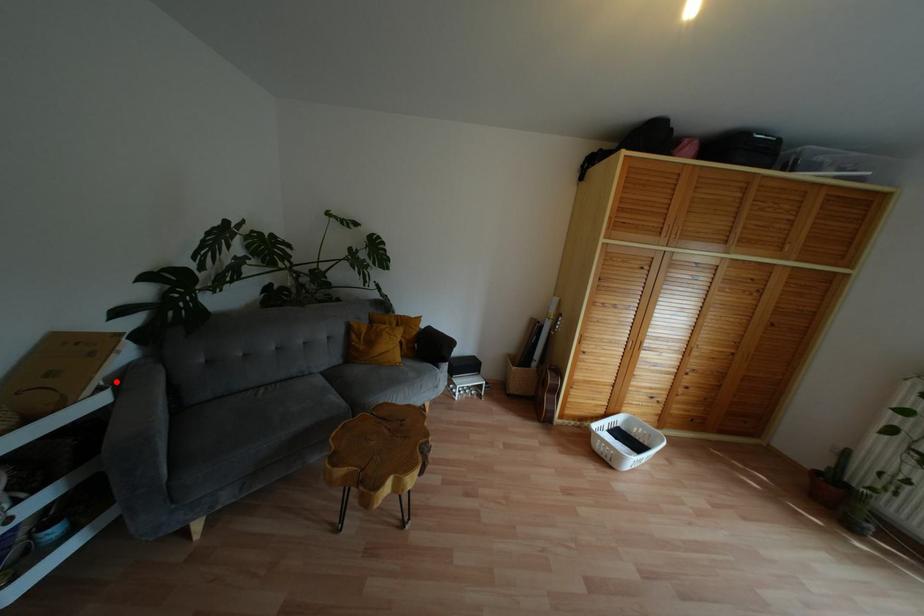
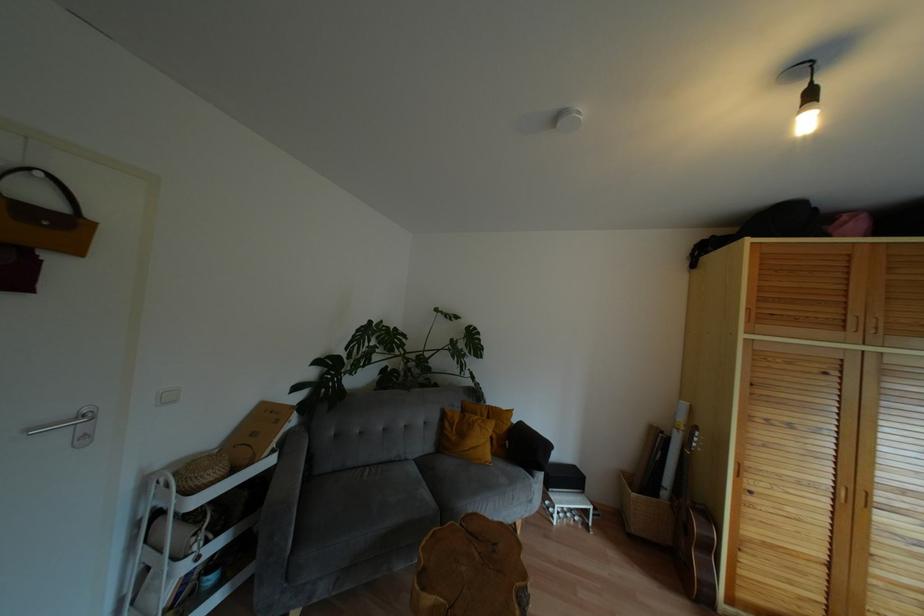
In the second image, find the point that corresponds to the highlighted location in the first image.

(282, 446)